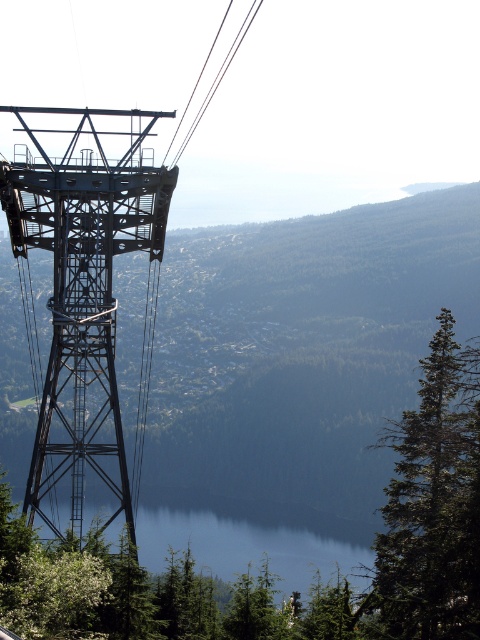
Question: Which of the following is the closest to the observer?

Choices:
 (A) metallic wire at upper center
 (B) metallic gray tower at left
 (C) metallic structure at left
 (D) blue glassy lake at center

Answer: (B)

Question: Which point appears closest to the camera in this image?

Choices:
 (A) (409, 364)
 (B) (100, 186)
 (C) (216, 33)

Answer: (B)

Question: Is blue glassy lake at center positioned before metallic wire at upper center?

Choices:
 (A) no
 (B) yes

Answer: (A)

Question: Does metallic gray tower at left lie behind metallic wire at upper center?

Choices:
 (A) yes
 (B) no

Answer: (B)

Question: Where is metallic gray tower at left located in relation to blue glassy lake at center in the image?

Choices:
 (A) below
 (B) above

Answer: (B)

Question: Which of the following is the farthest from the observer?

Choices:
 (A) metallic wire at upper center
 (B) metallic gray tower at left
 (C) metallic structure at left
 (D) blue glassy lake at center

Answer: (C)